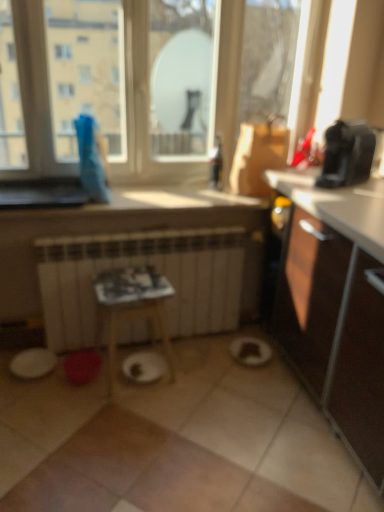
Locate an element on the screen. The height and width of the screenshot is (512, 384). free location to the right of white matte paper plate at center is located at coordinates (189, 366).